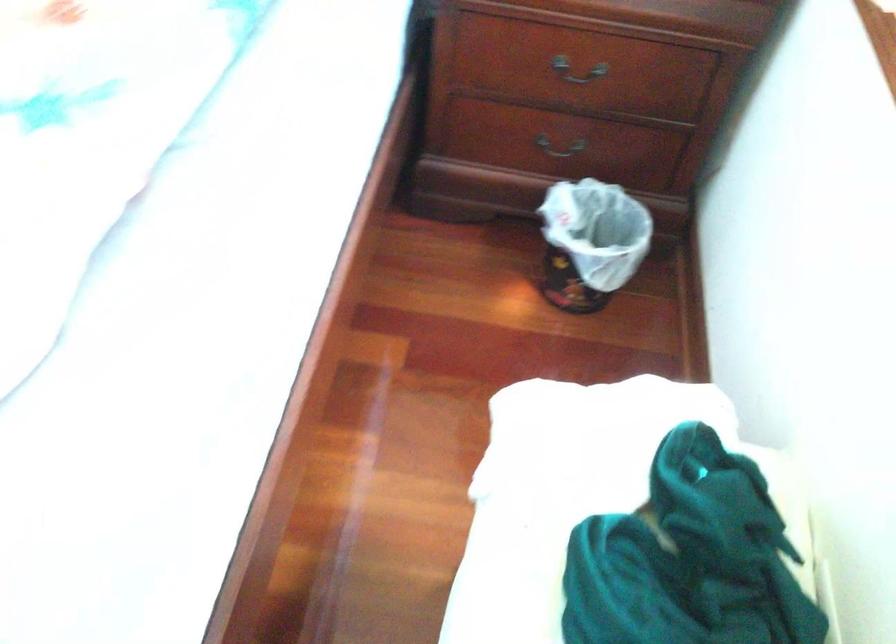
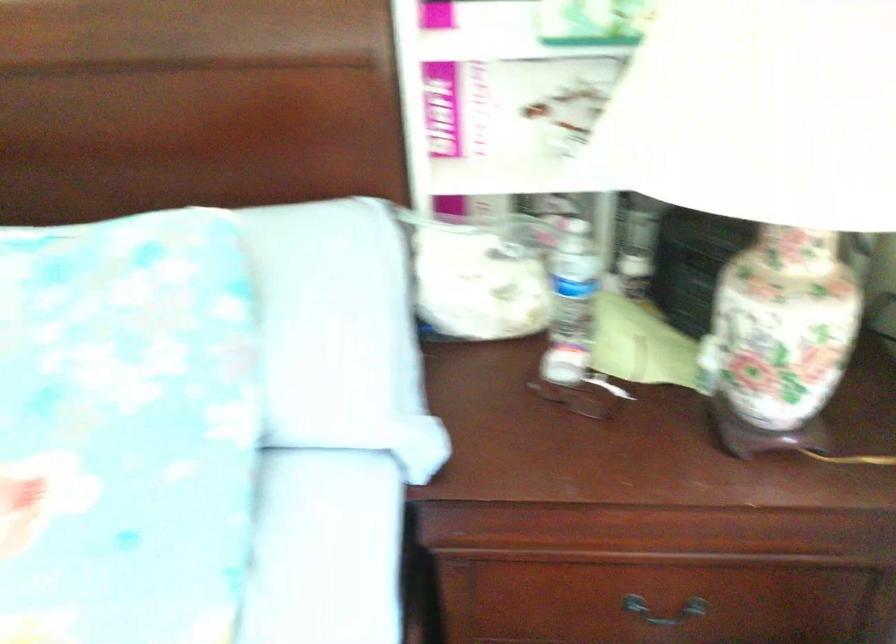
Question: The images are taken continuously from a first-person perspective. In which direction are you moving?

Choices:
 (A) Left
 (B) Right
 (C) Forward
 (D) Backward

Answer: (C)